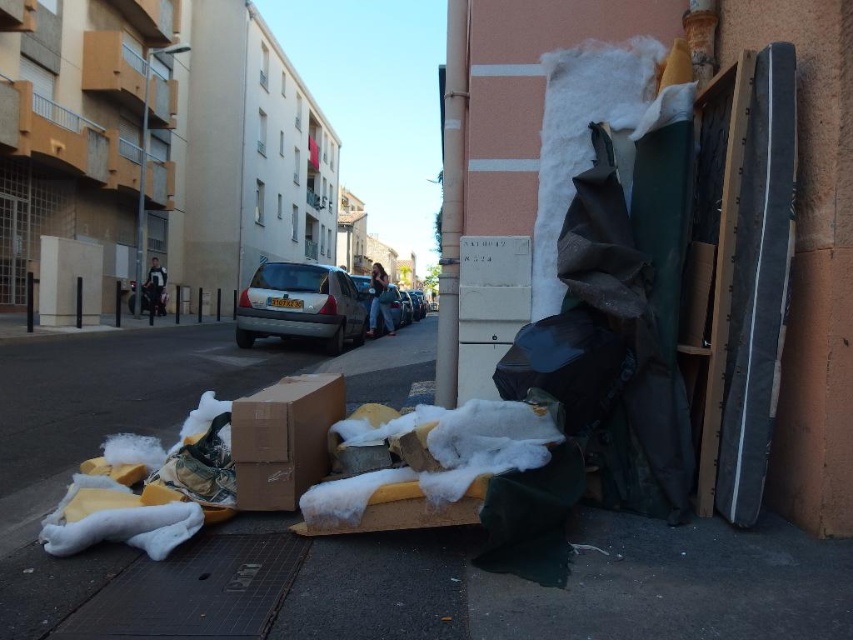
Does white foam at lower left have a smaller size compared to brown cardboard box at lower center?

Incorrect, white foam at lower left is not smaller in size than brown cardboard box at lower center.

Is white foam at lower left behind brown cardboard box at lower center?

No, white foam at lower left is in front of brown cardboard box at lower center.

Is point (409, 614) closer to viewer compared to point (305, 442)?

Yes, it is.

Image resolution: width=853 pixels, height=640 pixels. Identify the location of white foam at lower left. (453, 586).

Can you confirm if white foam at lower left is bigger than matte gray hatchback at center?

Incorrect, white foam at lower left is not larger than matte gray hatchback at center.

Between point (403, 547) and point (321, 312), which one is positioned behind?

Positioned behind is point (321, 312).

Which is behind, point (428, 618) or point (305, 300)?

The point (305, 300) is behind.

The image size is (853, 640). I want to click on white foam at lower left, so click(453, 586).

Who is taller, brown cardboard box at lower center or matte gray hatchback at center?

With more height is matte gray hatchback at center.

Is brown cardboard box at lower center to the right of matte gray hatchback at center from the viewer's perspective?

Yes, brown cardboard box at lower center is to the right of matte gray hatchback at center.

Image resolution: width=853 pixels, height=640 pixels. I want to click on brown cardboard box at lower center, so click(x=283, y=440).

Where is `brown cardboard box at lower center`? brown cardboard box at lower center is located at coordinates (283, 440).